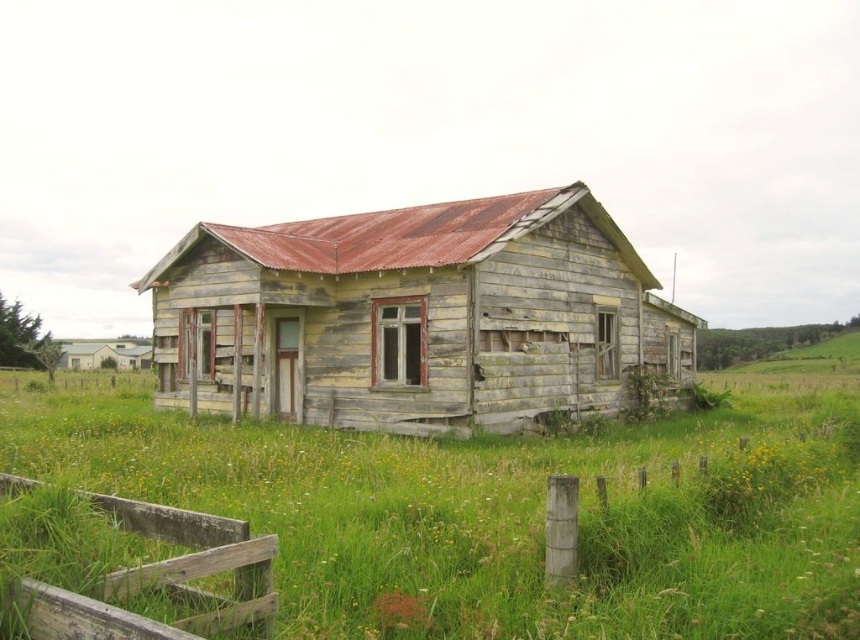
Question: Estimate the real-world distances between objects in this image. Which object is farther from the weathered wood fence at lower left?

Choices:
 (A) weathered wood hut at center
 (B) green grass at center

Answer: (A)

Question: Which point is farther from the camera taking this photo?

Choices:
 (A) (163, 630)
 (B) (594, 365)

Answer: (B)

Question: Does weathered wood hut at center appear on the left side of weathered wood fence at lower left?

Choices:
 (A) no
 (B) yes

Answer: (A)

Question: Does weathered wood hut at center come in front of weathered wood fence at lower left?

Choices:
 (A) yes
 (B) no

Answer: (B)

Question: Can you confirm if green grass at center is positioned to the right of weathered wood fence at lower left?

Choices:
 (A) no
 (B) yes

Answer: (A)

Question: Estimate the real-world distances between objects in this image. Which object is closer to the weathered wood hut at center?

Choices:
 (A) weathered wood fence at lower left
 (B) green grass at center

Answer: (B)